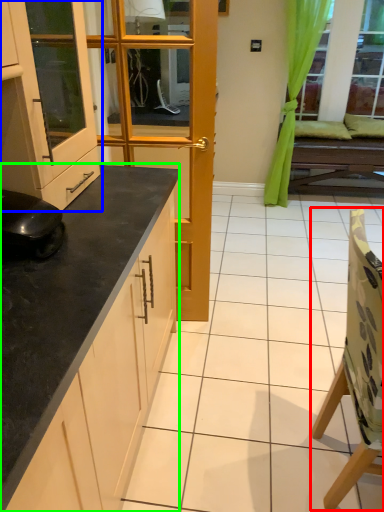
Question: Which is nearer to the chair (highlighted by a red box)? cabinetry (highlighted by a blue box) or countertop (highlighted by a green box).

Choices:
 (A) cabinetry
 (B) countertop

Answer: (B)